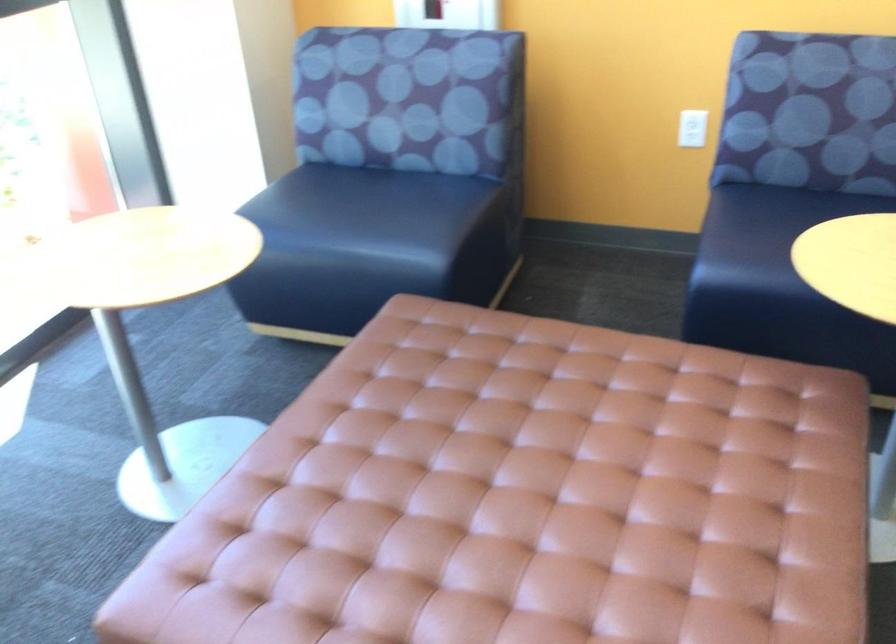
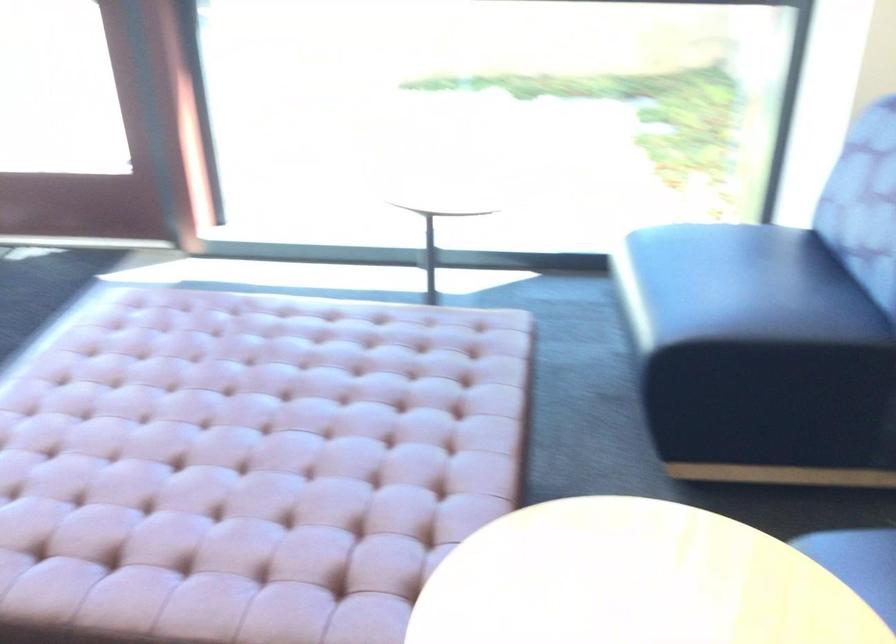
Locate, in the second image, the point that corresponds to (x=421, y=214) in the first image.

(724, 301)